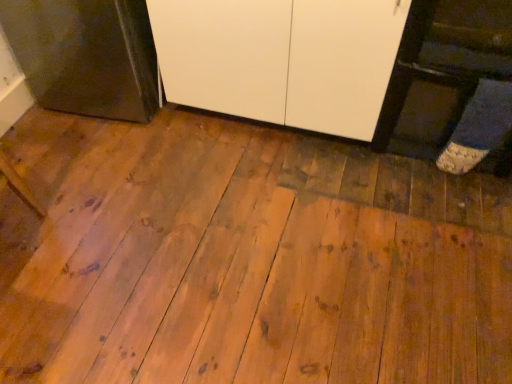
The image size is (512, 384). What are the coordinates of `white matte cabinet at center` in the screenshot? It's located at (281, 59).

This screenshot has width=512, height=384. What do you see at coordinates (281, 59) in the screenshot? I see `white matte cabinet at center` at bounding box center [281, 59].

Find the location of a particular element. This screenshot has height=384, width=512. metallic dark gray oven at left is located at coordinates (85, 55).

This screenshot has width=512, height=384. What do you see at coordinates (85, 55) in the screenshot?
I see `metallic dark gray oven at left` at bounding box center [85, 55].

Where is `white matte cabinet at center`? The height and width of the screenshot is (384, 512). white matte cabinet at center is located at coordinates (281, 59).

Which object is positioned more to the right, white matte cabinet at center or metallic dark gray oven at left?

Positioned to the right is white matte cabinet at center.

Relative to metallic dark gray oven at left, is white matte cabinet at center in front or behind?

Clearly, white matte cabinet at center is in front of metallic dark gray oven at left.

Is point (338, 32) closer or farther from the camera than point (152, 87)?

Clearly, point (338, 32) is closer to the camera than point (152, 87).

From the image's perspective, which is above, white matte cabinet at center or metallic dark gray oven at left?

metallic dark gray oven at left is shown above in the image.

From a real-world perspective, is white matte cabinet at center under metallic dark gray oven at left?

Actually, white matte cabinet at center is physically above metallic dark gray oven at left in the real world.

Looking at this image, can you confirm if white matte cabinet at center is thinner than metallic dark gray oven at left?

No, white matte cabinet at center is not thinner than metallic dark gray oven at left.

Which of these two, white matte cabinet at center or metallic dark gray oven at left, stands taller?

white matte cabinet at center is taller.

Who is bigger, white matte cabinet at center or metallic dark gray oven at left?

With larger size is white matte cabinet at center.

Do you think white matte cabinet at center is within metallic dark gray oven at left, or outside of it?

white matte cabinet at center is outside metallic dark gray oven at left.

Is white matte cabinet at center positioned far away from metallic dark gray oven at left?

Actually, white matte cabinet at center and metallic dark gray oven at left are a little close together.

Is white matte cabinet at center looking in the opposite direction of metallic dark gray oven at left?

No, white matte cabinet at center is not facing away from metallic dark gray oven at left.

The width and height of the screenshot is (512, 384). I want to click on cabinetry on the right of metallic dark gray oven at left, so click(x=281, y=59).

Considering the relative positions of metallic dark gray oven at left and white matte cabinet at center in the image provided, is metallic dark gray oven at left to the left of white matte cabinet at center from the viewer's perspective?

Correct, you'll find metallic dark gray oven at left to the left of white matte cabinet at center.

Between metallic dark gray oven at left and white matte cabinet at center, which one is positioned in front?

white matte cabinet at center is in front.

Which point is more distant from viewer, (x=138, y=26) or (x=203, y=50)?

Positioned behind is point (x=138, y=26).

From the image's perspective, which one is positioned higher, metallic dark gray oven at left or white matte cabinet at center?

From the image's view, metallic dark gray oven at left is above.

From a real-world perspective, is metallic dark gray oven at left physically below white matte cabinet at center?

Yes.

Which object is thinner, metallic dark gray oven at left or white matte cabinet at center?

metallic dark gray oven at left.

In the scene shown: Considering the relative sizes of metallic dark gray oven at left and white matte cabinet at center in the image provided, is metallic dark gray oven at left shorter than white matte cabinet at center?

Indeed, metallic dark gray oven at left has a lesser height compared to white matte cabinet at center.

Is metallic dark gray oven at left bigger or smaller than white matte cabinet at center?

metallic dark gray oven at left is smaller than white matte cabinet at center.

Do you think metallic dark gray oven at left is within white matte cabinet at center, or outside of it?

The correct answer is: outside.

Would you consider metallic dark gray oven at left to be distant from white matte cabinet at center?

They are positioned close to each other.

Is metallic dark gray oven at left looking in the opposite direction of white matte cabinet at center?

No.

How different are the orientations of metallic dark gray oven at left and white matte cabinet at center in degrees?

2.86 degrees separate the facing orientations of metallic dark gray oven at left and white matte cabinet at center.

How far apart are metallic dark gray oven at left and white matte cabinet at center?

They are 47.48 centimeters apart.

The image size is (512, 384). Identify the location of appliance behind the white matte cabinet at center. (85, 55).

At what (x,y) coordinates should I click in order to perform the action: click on cabinetry above the metallic dark gray oven at left (from a real-world perspective). Please return your answer as a coordinate pair (x, y). The height and width of the screenshot is (384, 512). Looking at the image, I should click on (281, 59).

Locate an element on the screen. Image resolution: width=512 pixels, height=384 pixels. cabinetry below the metallic dark gray oven at left (from the image's perspective) is located at coordinates (281, 59).